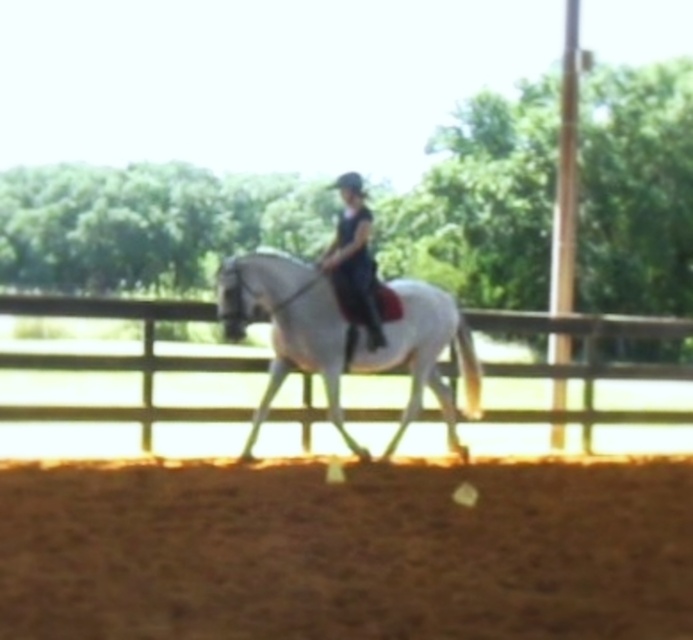
You are standing at the entrance of the equestrian arena and want to approach the point marked at coordinates (295,470). If you walk directly towards it, how far will you have to walk?

The distance of point (295,470) from viewer is 10.18 meters, so you will have to walk 10.18 meters to reach it.

In the scene shown: You are an equestrian instructor observing a rider and horse in an arena. You notice the brown wooden fence at center and the white glossy horse at center. Which object takes up more space in the image?

The brown wooden fence at center is larger in size than the white glossy horse at center, so it takes up more space in the image.

You are a horse trainer planning to place a new obstacle in the arena. The arena has a brown sandy dirt track at lower center. Where should you place the obstacle to ensure it is not on the track?

The brown sandy dirt track at lower center is located at point (346,548). To avoid placing the obstacle on the track, you should position it away from these coordinates.